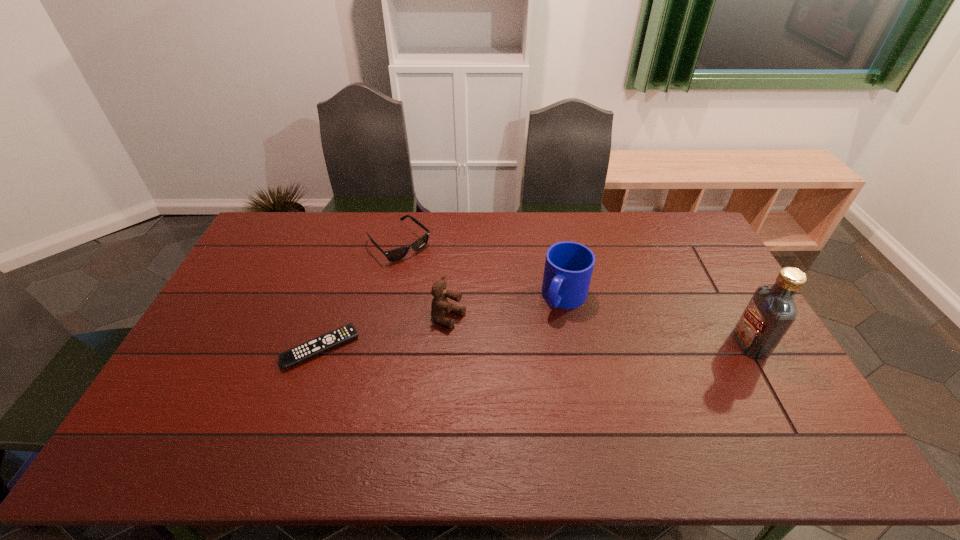
Locate an element on the screen. Image resolution: width=960 pixels, height=540 pixels. vacant space located 0.290m on the front-facing side of the tallest object is located at coordinates (636, 343).

I want to click on vacant space located 0.080m on the face of the teddy bear, so click(486, 335).

Where is `vacant space situated on the face of the teddy bear`? vacant space situated on the face of the teddy bear is located at coordinates (525, 354).

You are a GUI agent. You are given a task and a screenshot of the screen. Output one action in this format:
    pyautogui.click(x=<x>, y=<y>)
    Task: Click on the free point located 0.110m on the face of the teddy bear
    The width and height of the screenshot is (960, 540).
    Given the screenshot: What is the action you would take?
    pyautogui.click(x=494, y=339)

In order to click on free spot located 0.380m on the side with the handle of the mug in this screenshot , I will do `click(499, 415)`.

Where is `free spot located 0.250m on the side with the handle of the mug`? The image size is (960, 540). free spot located 0.250m on the side with the handle of the mug is located at coordinates click(x=521, y=377).

You are a GUI agent. You are given a task and a screenshot of the screen. Output one action in this format:
    pyautogui.click(x=<x>, y=<y>)
    Task: Click on the vacant space located 0.110m on the side with the handle of the mug
    The height and width of the screenshot is (540, 960).
    Given the screenshot: What is the action you would take?
    pyautogui.click(x=542, y=342)

Where is `free space located on the front-facing side of the sunglasses`? This screenshot has height=540, width=960. free space located on the front-facing side of the sunglasses is located at coordinates (460, 300).

Find the location of a particular element. The width and height of the screenshot is (960, 540). vacant region located 0.130m on the front-facing side of the sunglasses is located at coordinates (439, 280).

The width and height of the screenshot is (960, 540). Find the location of `free space located on the front-facing side of the sunglasses`. free space located on the front-facing side of the sunglasses is located at coordinates (440, 282).